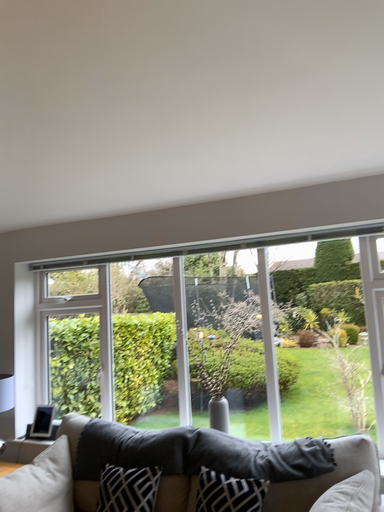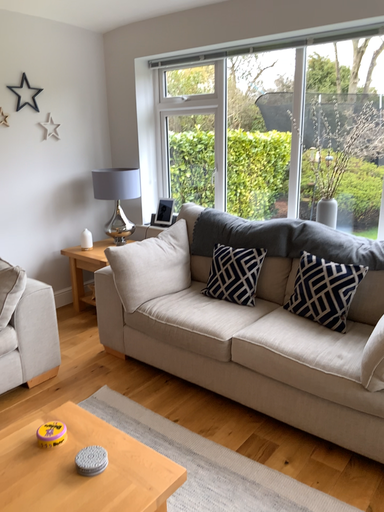
Question: How did the camera likely rotate when shooting the video?

Choices:
 (A) rotated right
 (B) rotated left

Answer: (B)